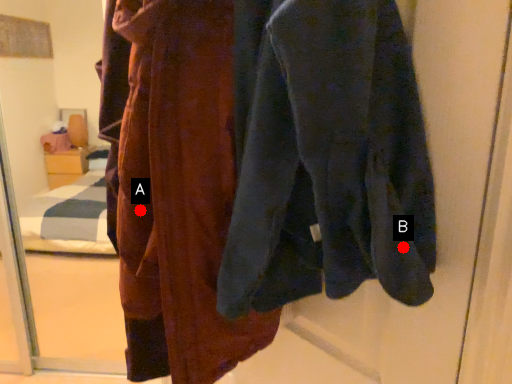
Question: Two points are circled on the image, labeled by A and B beside each circle. Which point is closer to the camera?

Choices:
 (A) A is closer
 (B) B is closer

Answer: (B)